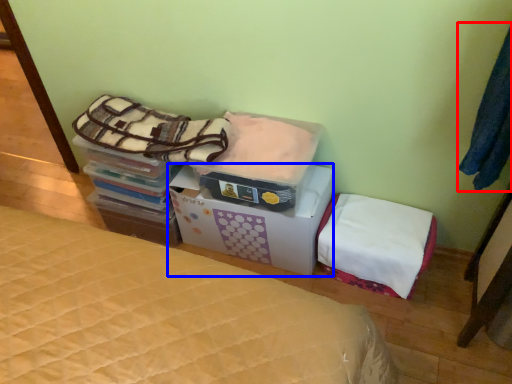
Question: Which point is closer to the camera, clothing (highlighted by a red box) or cardboard box (highlighted by a blue box)?

Choices:
 (A) clothing
 (B) cardboard box

Answer: (A)